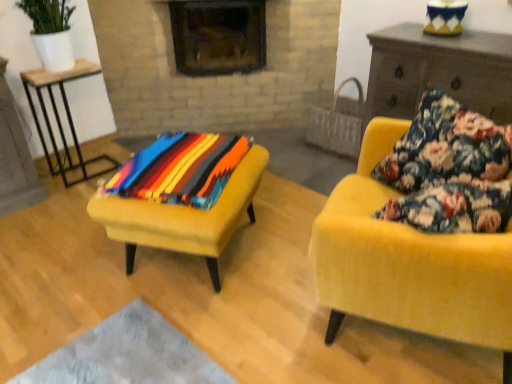
Question: Can you confirm if wooden table at left is bigger than wooden dresser at right?

Choices:
 (A) no
 (B) yes

Answer: (A)

Question: Is wooden dresser at right a part of wooden table at left?

Choices:
 (A) yes
 (B) no

Answer: (B)

Question: Is wooden table at left facing towards wooden dresser at right?

Choices:
 (A) no
 (B) yes

Answer: (A)

Question: Considering the relative positions of wooden table at left and wooden dresser at right in the image provided, is wooden table at left to the left of wooden dresser at right from the viewer's perspective?

Choices:
 (A) yes
 (B) no

Answer: (A)

Question: Does wooden table at left come behind wooden dresser at right?

Choices:
 (A) yes
 (B) no

Answer: (A)

Question: Is velvet yellow armchair at right situated inside white ceramic pot at upper left or outside?

Choices:
 (A) outside
 (B) inside

Answer: (A)

Question: Considering their positions, is velvet yellow armchair at right located in front of or behind white ceramic pot at upper left?

Choices:
 (A) behind
 (B) front

Answer: (B)

Question: Considering the positions of velvet yellow armchair at right and white ceramic pot at upper left in the image, is velvet yellow armchair at right taller or shorter than white ceramic pot at upper left?

Choices:
 (A) short
 (B) tall

Answer: (B)

Question: From the image's perspective, is velvet yellow armchair at right located above or below white ceramic pot at upper left?

Choices:
 (A) above
 (B) below

Answer: (B)

Question: From a real-world perspective, is brick fireplace at upper center above or below multicolored woven blanket at center?

Choices:
 (A) below
 (B) above

Answer: (B)

Question: Relative to multicolored woven blanket at center, is brick fireplace at upper center in front or behind?

Choices:
 (A) behind
 (B) front

Answer: (A)

Question: From the image's perspective, is brick fireplace at upper center positioned above or below multicolored woven blanket at center?

Choices:
 (A) below
 (B) above

Answer: (B)

Question: Is brick fireplace at upper center inside the boundaries of multicolored woven blanket at center, or outside?

Choices:
 (A) inside
 (B) outside

Answer: (B)

Question: In terms of height, does velvet yellow armchair at right look taller or shorter compared to velvet yellow stool at center?

Choices:
 (A) short
 (B) tall

Answer: (B)

Question: From a real-world perspective, is velvet yellow armchair at right above or below velvet yellow stool at center?

Choices:
 (A) below
 (B) above

Answer: (B)